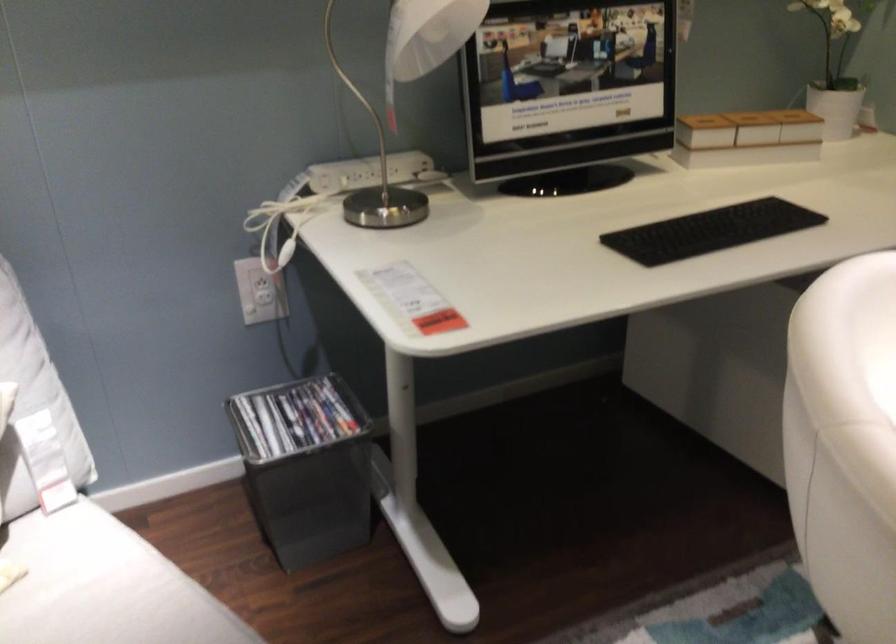
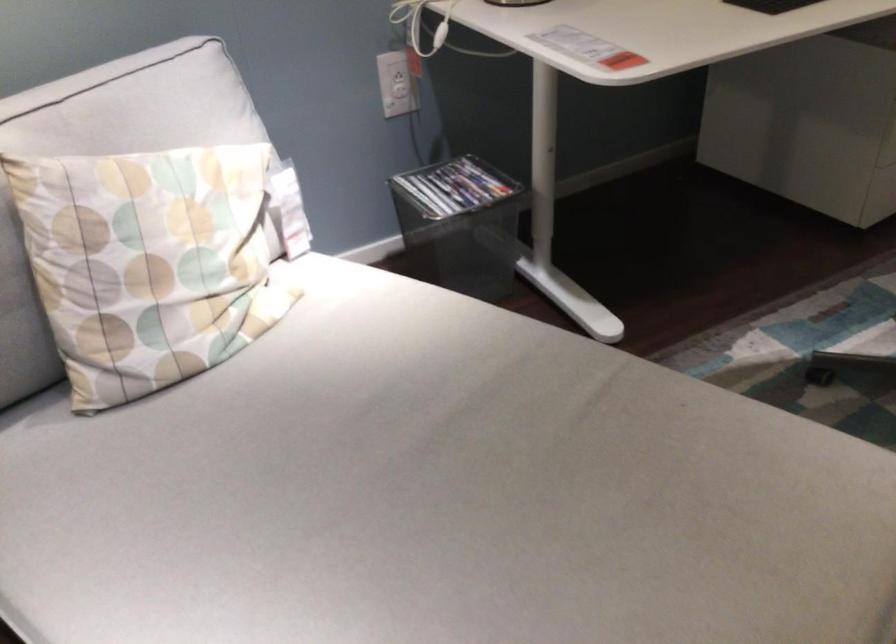
Where in the second image is the point corresponding to pixel 279 281 from the first image?

(398, 77)